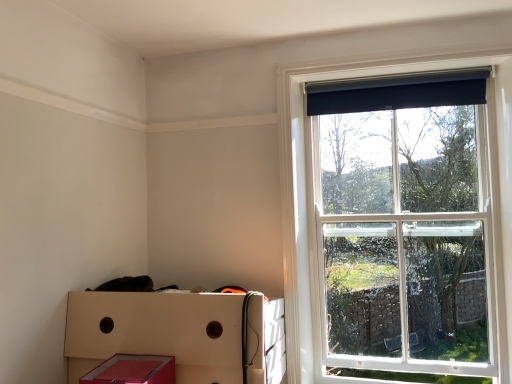
Describe the element at coordinates (395, 95) in the screenshot. Image resolution: width=512 pixels, height=384 pixels. I see `black fabric curtain at upper right` at that location.

What do you see at coordinates (133, 370) in the screenshot? I see `matte red storage box at lower left` at bounding box center [133, 370].

Image resolution: width=512 pixels, height=384 pixels. I want to click on black roller blind at upper right, so click(x=305, y=188).

Describe the element at coordinates (305, 188) in the screenshot. The image size is (512, 384). I see `black roller blind at upper right` at that location.

The width and height of the screenshot is (512, 384). I want to click on black fabric curtain at upper right, so click(395, 95).

How different are the orientations of black fabric curtain at upper right and black roller blind at upper right in degrees?

There is a 1.87-degree angle between the facing directions of black fabric curtain at upper right and black roller blind at upper right.

Is black fabric curtain at upper right bigger or smaller than black roller blind at upper right?

Considering their sizes, black fabric curtain at upper right takes up less space than black roller blind at upper right.

Considering the sizes of objects black fabric curtain at upper right and black roller blind at upper right in the image provided, who is thinner, black fabric curtain at upper right or black roller blind at upper right?

black fabric curtain at upper right is thinner.

Between black fabric curtain at upper right and black roller blind at upper right, which one is positioned in front?

black roller blind at upper right.

In terms of size, does matte red plastic crate at lower left appear bigger or smaller than black roller blind at upper right?

In the image, matte red plastic crate at lower left appears to be larger than black roller blind at upper right.

Is matte red plastic crate at lower left facing towards black roller blind at upper right?

No, matte red plastic crate at lower left does not turn towards black roller blind at upper right.

From the image's perspective, which is below, matte red plastic crate at lower left or black roller blind at upper right?

matte red plastic crate at lower left, from the image's perspective.

Which object is wider, matte red storage box at lower left or black roller blind at upper right?

matte red storage box at lower left is wider.

Between matte red storage box at lower left and black roller blind at upper right, which one has more height?

black roller blind at upper right.

I want to click on window on the right of the matte red storage box at lower left, so click(305, 188).

From the image's perspective, is matte red storage box at lower left over matte red plastic crate at lower left?

Yes, from the image's perspective, matte red storage box at lower left is on top of matte red plastic crate at lower left.

Looking at this image, is matte red storage box at lower left directly adjacent to matte red plastic crate at lower left?

matte red storage box at lower left is not next to matte red plastic crate at lower left, and they're not touching.

Is matte red storage box at lower left further to the viewer compared to matte red plastic crate at lower left?

No.

Considering the sizes of matte red storage box at lower left and matte red plastic crate at lower left in the image, is matte red storage box at lower left wider or thinner than matte red plastic crate at lower left?

Clearly, matte red storage box at lower left has less width compared to matte red plastic crate at lower left.

Can you confirm if black roller blind at upper right is thinner than matte red plastic crate at lower left?

Yes.

Is black roller blind at upper right in contact with matte red plastic crate at lower left?

black roller blind at upper right is not next to matte red plastic crate at lower left, and they're not touching.

Would you say black roller blind at upper right is to the left or to the right of matte red plastic crate at lower left in the picture?

black roller blind at upper right is to the right of matte red plastic crate at lower left.

Is black roller blind at upper right surrounding matte red plastic crate at lower left?

No.

Identify the location of storage box located below the black fabric curtain at upper right (from the image's perspective). This screenshot has height=384, width=512. (133, 370).

Is point (126, 354) behind point (321, 114)?

No, (126, 354) is in front of (321, 114).

Which object is closer to the camera, matte red storage box at lower left or black fabric curtain at upper right?

Positioned in front is matte red storage box at lower left.

Between matte red storage box at lower left and black fabric curtain at upper right, which one has less height?

matte red storage box at lower left.

Considering the sizes of objects black roller blind at upper right and matte red storage box at lower left in the image provided, who is bigger, black roller blind at upper right or matte red storage box at lower left?

With larger size is black roller blind at upper right.

Considering the relative positions of black roller blind at upper right and matte red storage box at lower left in the image provided, is black roller blind at upper right to the left of matte red storage box at lower left from the viewer's perspective?

No, black roller blind at upper right is not to the left of matte red storage box at lower left.

From the image's perspective, would you say black roller blind at upper right is shown under matte red storage box at lower left?

No.

Between black roller blind at upper right and matte red storage box at lower left, which one is positioned in front?

matte red storage box at lower left.

Find the location of `window that is below the black fabric curtain at upper right (from the image's perspective)`. window that is below the black fabric curtain at upper right (from the image's perspective) is located at coordinates (305, 188).

Locate an element on the screen. This screenshot has width=512, height=384. window that appears behind the matte red plastic crate at lower left is located at coordinates (305, 188).

From the image, which object appears to be nearer to matte red plastic crate at lower left, black fabric curtain at upper right or black roller blind at upper right?

black roller blind at upper right is positioned closer to the anchor matte red plastic crate at lower left.

Looking at the image, which one is located closer to matte red plastic crate at lower left, black roller blind at upper right or black fabric curtain at upper right?

black roller blind at upper right is closer to matte red plastic crate at lower left.

Based on their spatial positions, is matte red plastic crate at lower left or black fabric curtain at upper right closer to matte red storage box at lower left?

Based on the image, matte red plastic crate at lower left appears to be nearer to matte red storage box at lower left.

Which object lies further to the anchor point matte red plastic crate at lower left, black fabric curtain at upper right or matte red storage box at lower left?

black fabric curtain at upper right.

Based on their spatial positions, is matte red storage box at lower left or black roller blind at upper right closer to matte red plastic crate at lower left?

The object closer to matte red plastic crate at lower left is matte red storage box at lower left.

Estimate the real-world distances between objects in this image. Which object is further from black fabric curtain at upper right, black roller blind at upper right or matte red storage box at lower left?

matte red storage box at lower left is further to black fabric curtain at upper right.

Which object lies nearer to the anchor point black roller blind at upper right, matte red plastic crate at lower left or matte red storage box at lower left?

matte red plastic crate at lower left.

Looking at the image, which one is located further to black roller blind at upper right, black fabric curtain at upper right or matte red storage box at lower left?

The object further to black roller blind at upper right is matte red storage box at lower left.

Identify the location of storage box between black fabric curtain at upper right and matte red plastic crate at lower left in the up-down direction. (133, 370).

You are a GUI agent. You are given a task and a screenshot of the screen. Output one action in this format:
    pyautogui.click(x=<x>, y=<y>)
    Task: Click on the curtain between matte red storage box at lower left and black roller blind at upper right from left to right
    The width and height of the screenshot is (512, 384).
    Given the screenshot: What is the action you would take?
    pyautogui.click(x=395, y=95)

Where is `crate located between matte red storage box at lower left and black roller blind at upper right in the left-right direction`? Image resolution: width=512 pixels, height=384 pixels. crate located between matte red storage box at lower left and black roller blind at upper right in the left-right direction is located at coordinates (157, 332).

Where is `window between black fabric curtain at upper right and matte red plastic crate at lower left vertically`? window between black fabric curtain at upper right and matte red plastic crate at lower left vertically is located at coordinates (305, 188).